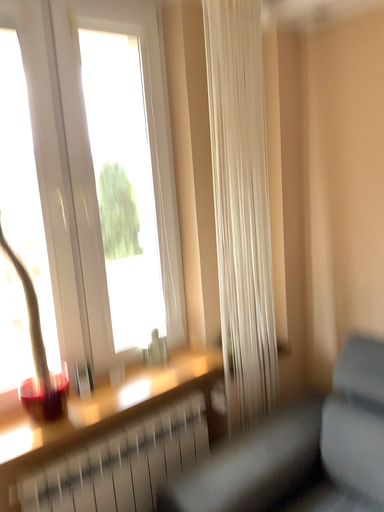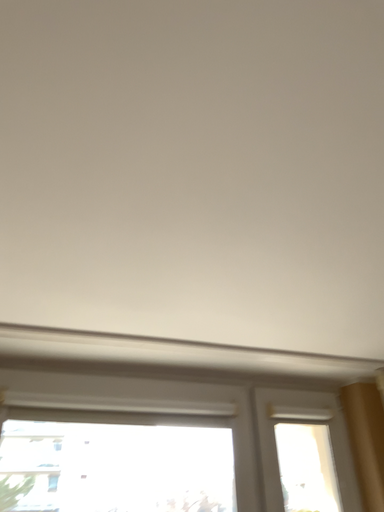
Question: Which way did the camera rotate in the video?

Choices:
 (A) rotated right
 (B) rotated left

Answer: (B)